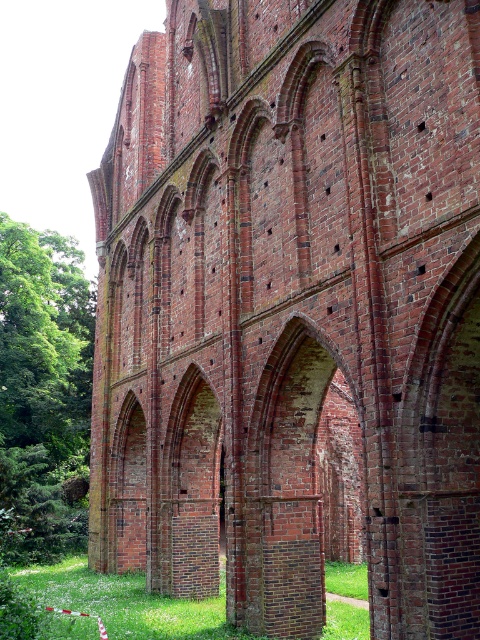
Is green leafy tree at left positioned behind green grass at lower center?

Yes, it is behind green grass at lower center.

Is green leafy tree at left bigger than green grass at lower center?

Indeed, green leafy tree at left has a larger size compared to green grass at lower center.

Find the location of a particular element. green leafy tree at left is located at coordinates (44, 392).

In order to click on green leafy tree at left in this screenshot , I will do `click(44, 392)`.